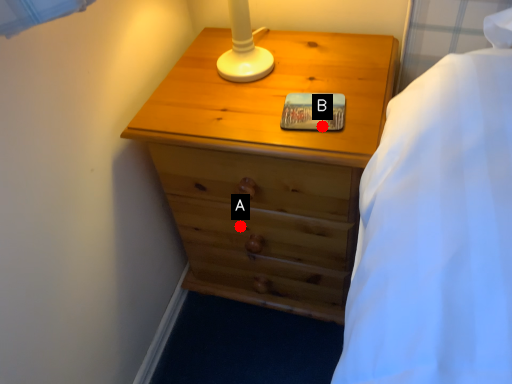
Question: Two points are circled on the image, labeled by A and B beside each circle. Which point appears farthest from the camera in this image?

Choices:
 (A) A is further
 (B) B is further

Answer: (A)